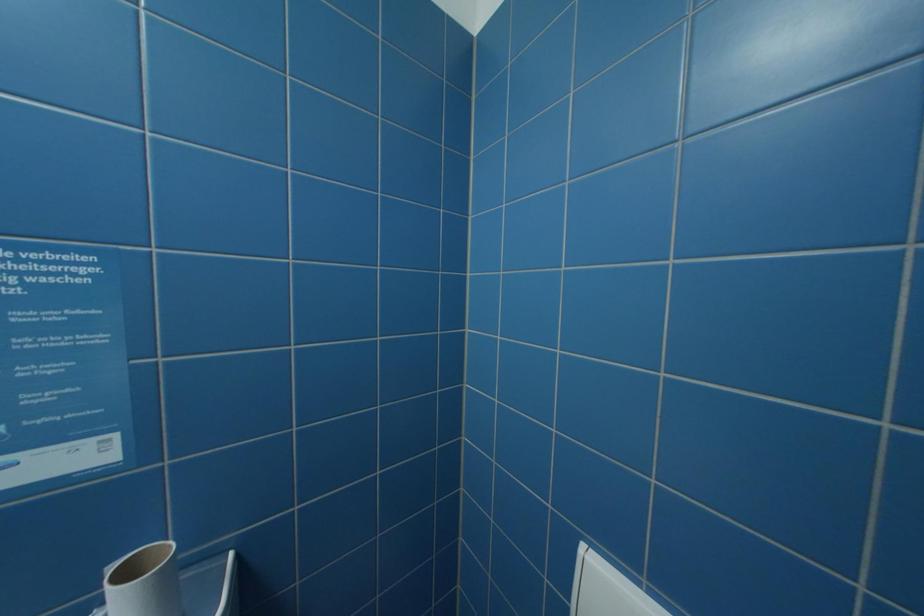
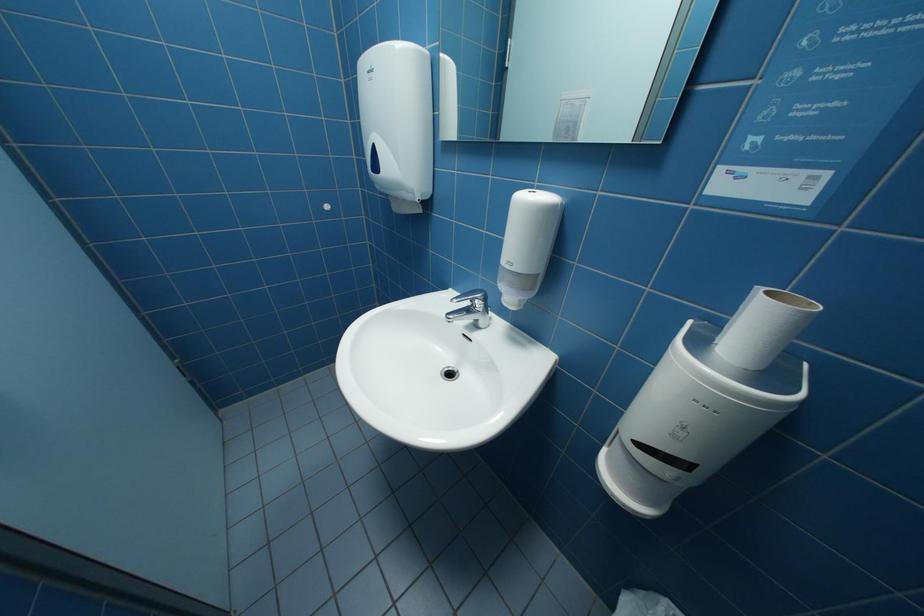
How did the camera likely rotate?

The camera's rotation is toward left-down.